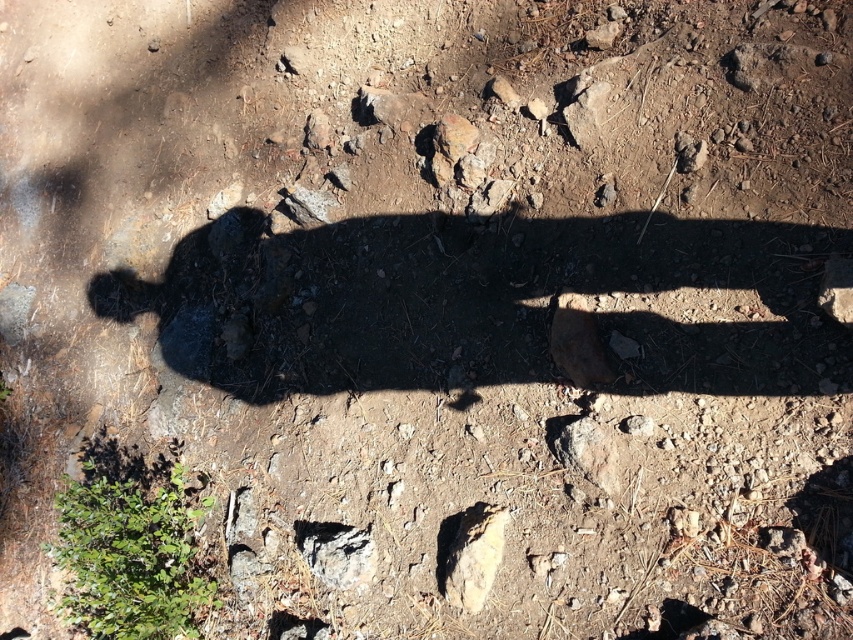
You are a hiker trying to place a small flag exactly halfway between the smooth beige rock at lower center and the gray rough rock at center. Which rock will the flag be closer to?

The flag will be closer to the gray rough rock at center because the smooth beige rock at lower center is taller, but the question is about distance between them, so the height doesn